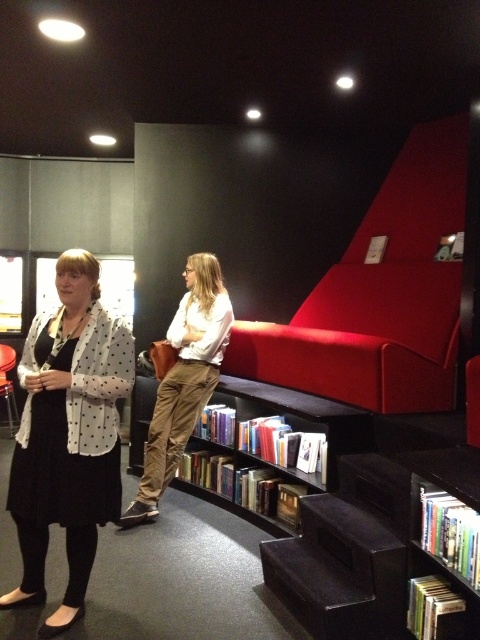
Is white dotted blazer at center below matte white blouse at center?

Indeed, white dotted blazer at center is positioned under matte white blouse at center.

Locate an element on the screen. white dotted blazer at center is located at coordinates (68, 435).

Where is `white dotted blazer at center`? white dotted blazer at center is located at coordinates (68, 435).

Is matte white blouse at center thinner than wooden bookshelf at lower center?

Correct, matte white blouse at center's width is less than wooden bookshelf at lower center's.

Between matte white blouse at center and wooden bookshelf at lower center, which one appears on the left side from the viewer's perspective?

matte white blouse at center

Which is behind, point (162, 420) or point (144, 419)?

Point (144, 419)

Locate an element on the screen. Image resolution: width=480 pixels, height=640 pixels. matte white blouse at center is located at coordinates (183, 380).